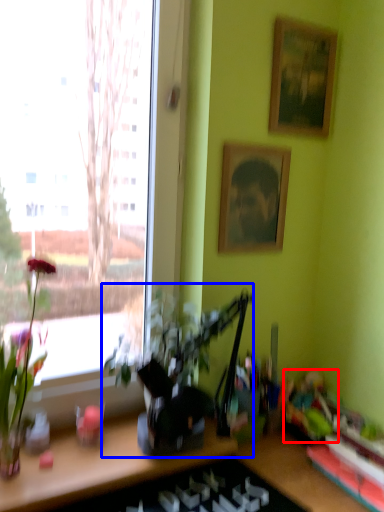
Question: Which object appears closest to the camera in this image, toy (highlighted by a red box) or houseplant (highlighted by a blue box)?

Choices:
 (A) toy
 (B) houseplant

Answer: (B)